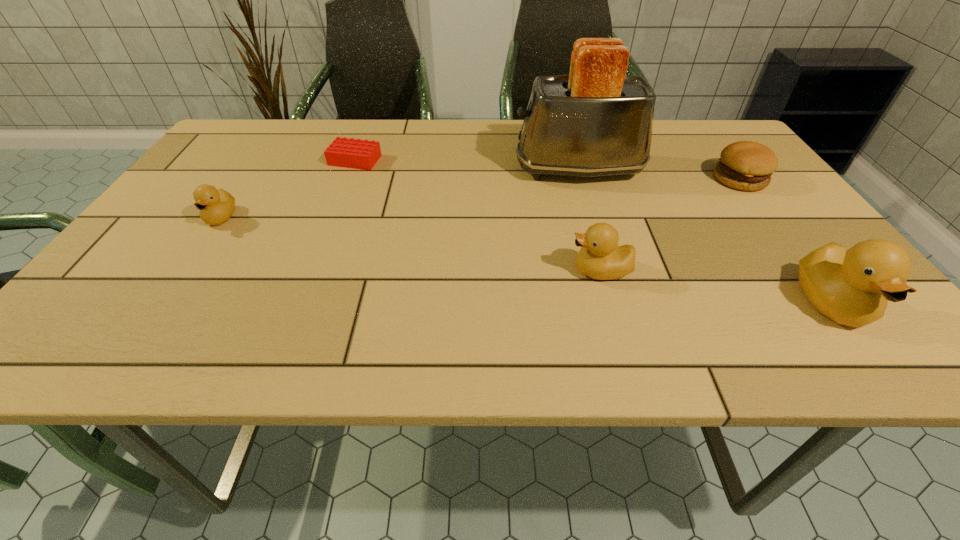
At what (x,y) coordinates should I click in order to perform the action: click on free space between the second duckling from left to right and the tallest duckling. Please return your answer as a coordinate pair (x, y). The height and width of the screenshot is (540, 960). Looking at the image, I should click on (716, 287).

What are the coordinates of `vacant region between the tallest duckling and the hamburger` in the screenshot? It's located at (786, 241).

At what (x,y) coordinates should I click in order to perform the action: click on free spot between the rightmost duckling and the shortest duckling. Please return your answer as a coordinate pair (x, y). Looking at the image, I should click on (527, 260).

What are the coordinates of `vacant space in between the Lego and the fourth shortest object` in the screenshot? It's located at (478, 215).

I want to click on free point between the second shortest duckling and the tallest object, so click(x=589, y=220).

Locate an element on the screen. vacant space in between the second duckling from left to right and the tallest object is located at coordinates (589, 220).

The image size is (960, 540). What are the coordinates of `blank region between the toaster and the hamburger` in the screenshot? It's located at (660, 174).

This screenshot has height=540, width=960. I want to click on vacant space that's between the tallest object and the fifth shortest object, so click(706, 237).

Locate an element on the screen. vacant point located between the rightmost duckling and the second tallest duckling is located at coordinates (716, 287).

The width and height of the screenshot is (960, 540). I want to click on object that is the fifth nearest to the toaster, so click(x=216, y=206).